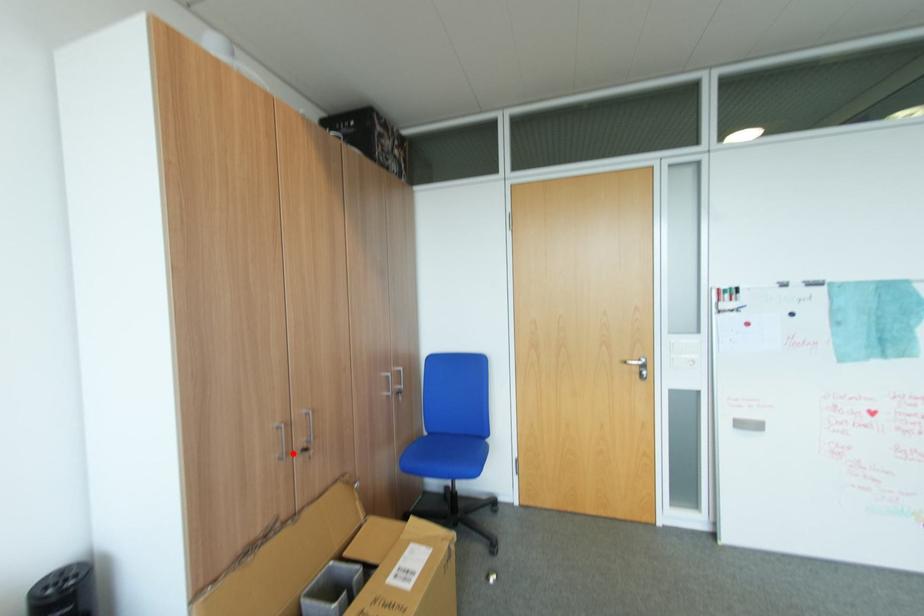
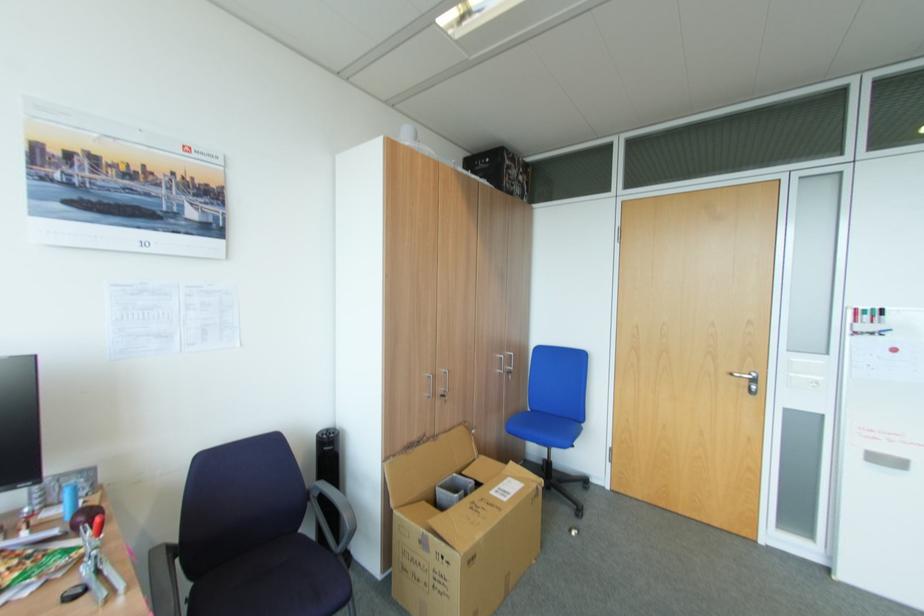
Question: I am providing you with two images of the same scene from different viewpoints. A red point is shown in image1. For the corresponding object point in image2, is it positioned nearer or farther from the camera?

Choices:
 (A) Nearer
 (B) Farther

Answer: (B)